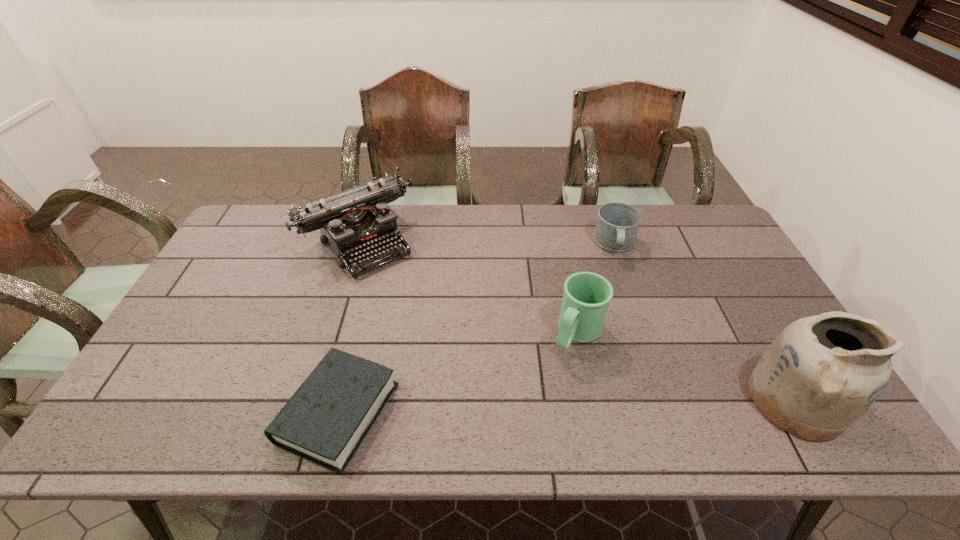
Locate an element on the screen. This screenshot has height=540, width=960. free location located on the side of the third tallest object with the handle is located at coordinates (543, 383).

Where is `vacant space situated 0.080m on the side of the third tallest object with the handle`? vacant space situated 0.080m on the side of the third tallest object with the handle is located at coordinates (550, 375).

You are a GUI agent. You are given a task and a screenshot of the screen. Output one action in this format:
    pyautogui.click(x=<x>, y=<y>)
    Task: Click on the free location located 0.180m on the keyboard of the typewriter
    Image resolution: width=960 pixels, height=540 pixels.
    Given the screenshot: What is the action you would take?
    pyautogui.click(x=416, y=306)

Identify the location of vacant space positioned on the keyboard of the typewriter. The width and height of the screenshot is (960, 540). (396, 285).

I want to click on free space located 0.070m on the keyboard of the typewriter, so click(396, 285).

This screenshot has height=540, width=960. Find the location of `free space located on the side of the right mug with the handle`. free space located on the side of the right mug with the handle is located at coordinates (620, 304).

Locate an element on the screen. free location located 0.170m on the side of the right mug with the handle is located at coordinates (620, 301).

Where is `vacant point located 0.400m on the side of the right mug with the handle`? vacant point located 0.400m on the side of the right mug with the handle is located at coordinates (625, 368).

I want to click on typewriter located at the far edge, so click(354, 222).

Image resolution: width=960 pixels, height=540 pixels. I want to click on mug present at the far edge, so click(x=617, y=224).